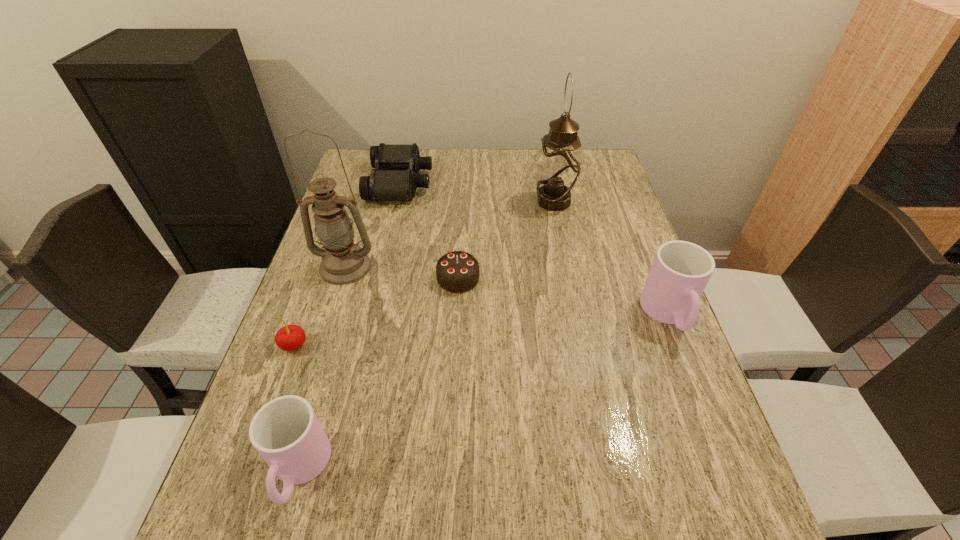
I want to click on blank space at the far right corner of the desktop, so click(613, 182).

Find the location of a particular element. This screenshot has width=960, height=540. vacant area between the fifth object from left to right and the farther oil lamp is located at coordinates (506, 240).

At what (x,y) coordinates should I click in order to perform the action: click on vacant space that's between the right cup and the nearer cup. Please return your answer as a coordinate pair (x, y). The image size is (960, 540). Looking at the image, I should click on [484, 393].

The width and height of the screenshot is (960, 540). Find the location of `free space between the nearer oil lamp and the fifth object from left to right`. free space between the nearer oil lamp and the fifth object from left to right is located at coordinates (402, 273).

This screenshot has width=960, height=540. In order to click on unoccupied area between the left oil lamp and the taller cup in this screenshot , I will do `click(507, 291)`.

This screenshot has height=540, width=960. In order to click on free space between the binoculars and the taller cup in this screenshot , I will do `click(535, 249)`.

Find the location of a particular element. blank region between the taller cup and the shorter cup is located at coordinates (484, 393).

Find the location of a particular element. The image size is (960, 540). free spot between the taller cup and the nearer cup is located at coordinates (484, 393).

The image size is (960, 540). In order to click on vacant space in between the farther oil lamp and the third tallest object in this screenshot , I will do `click(612, 258)`.

I want to click on free space that is in between the left oil lamp and the third shortest object, so click(x=320, y=306).